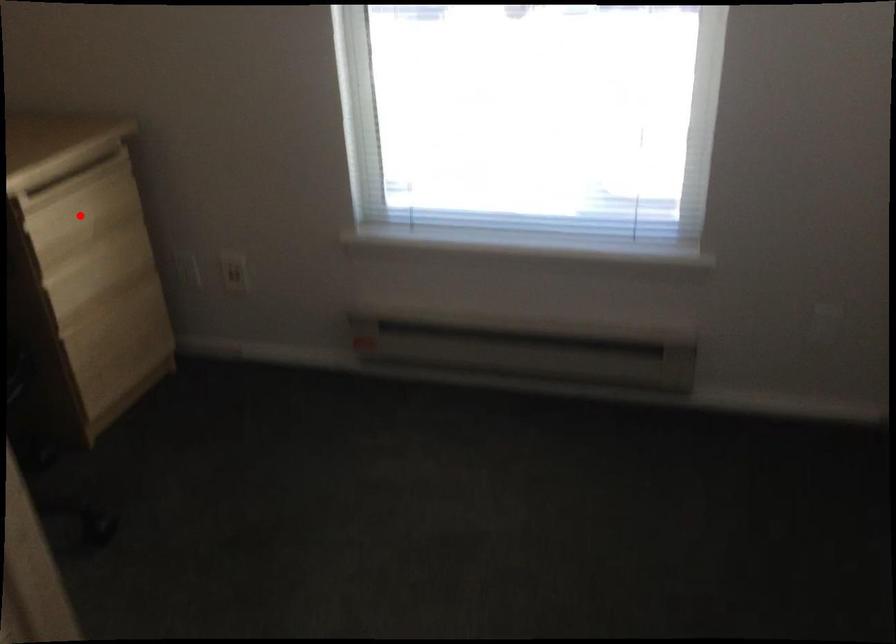
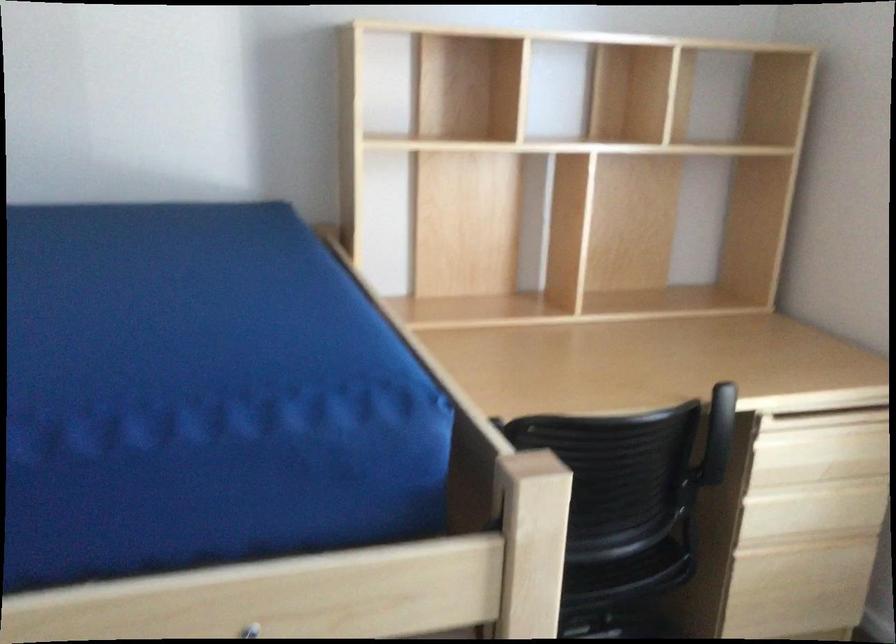
The point at the highlighted location is marked in the first image. Where is the corresponding point in the second image?

(819, 450)